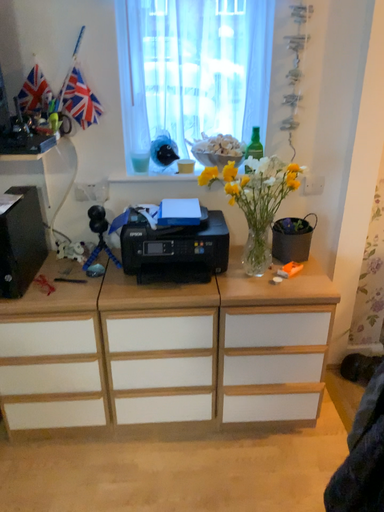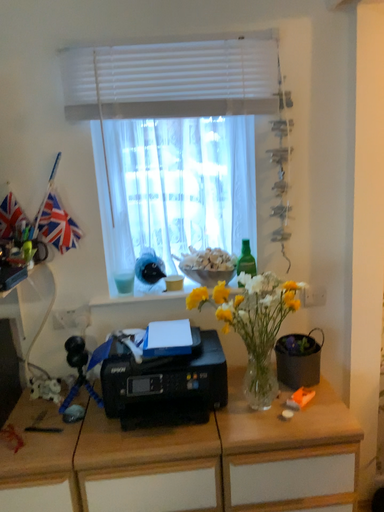
Question: Which way did the camera rotate in the video?

Choices:
 (A) rotated downward
 (B) rotated upward

Answer: (B)